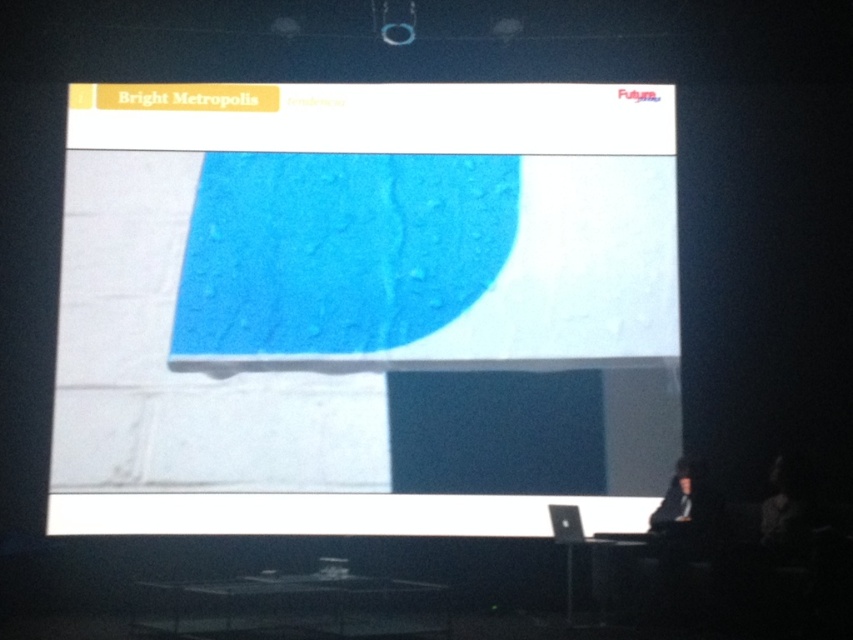
Question: Can you confirm if matte blue fabric at center is bigger than dark fabric figure at lower right?

Choices:
 (A) no
 (B) yes

Answer: (B)

Question: Which object appears closest to the camera in this image?

Choices:
 (A) matte blue fabric at center
 (B) dark fabric figure at lower right
 (C) dark hair at lower right

Answer: (C)

Question: Which of the following is the closest to the observer?

Choices:
 (A) matte blue fabric at center
 (B) dark fabric figure at lower right
 (C) dark hair at lower right

Answer: (C)

Question: Which object is closer to the camera taking this photo?

Choices:
 (A) dark hair at lower right
 (B) dark fabric figure at lower right

Answer: (A)

Question: Is matte blue fabric at center bigger than dark fabric figure at lower right?

Choices:
 (A) yes
 (B) no

Answer: (A)

Question: Can you confirm if matte blue fabric at center is positioned above dark fabric figure at lower right?

Choices:
 (A) yes
 (B) no

Answer: (A)